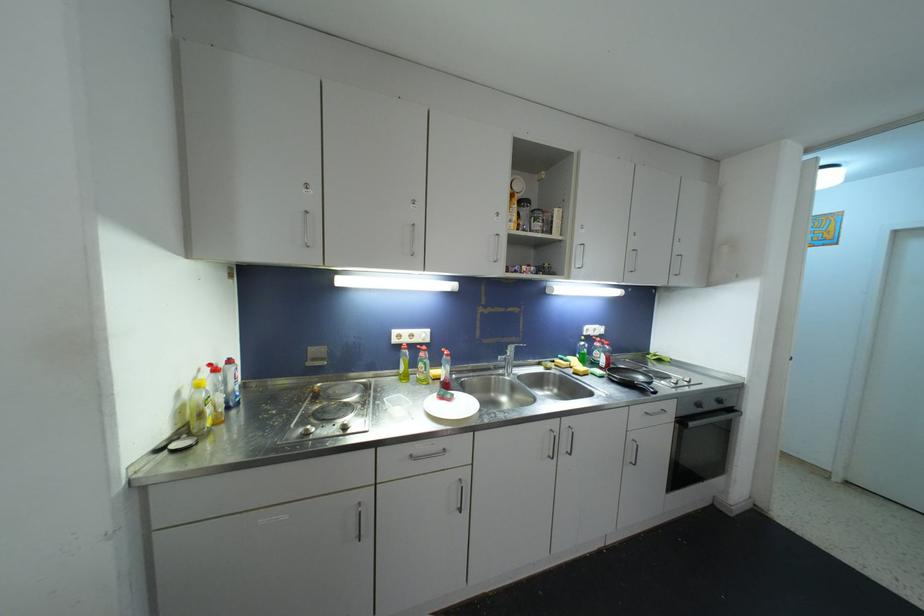
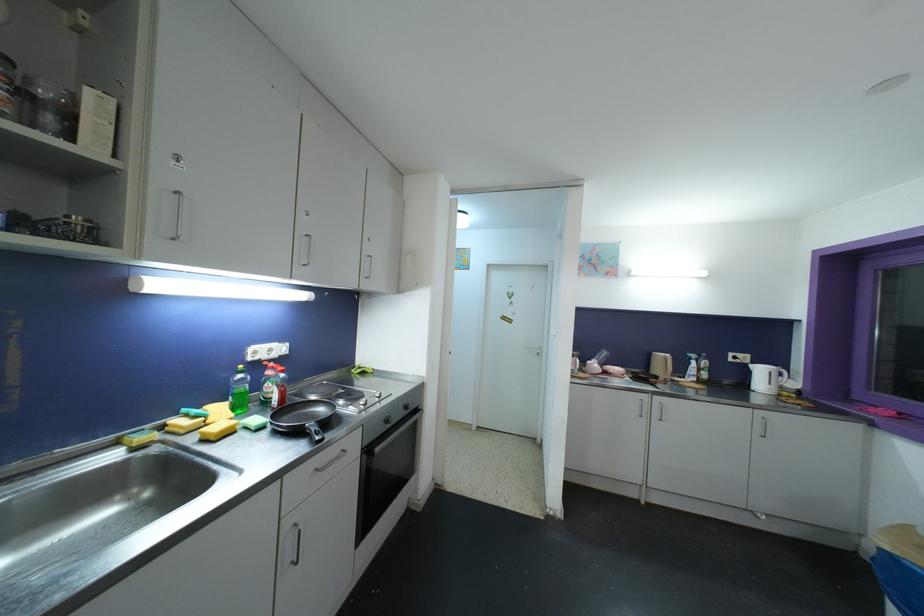
In the second image, find the point that corresponds to the point at 590,374 in the first image.

(236, 430)